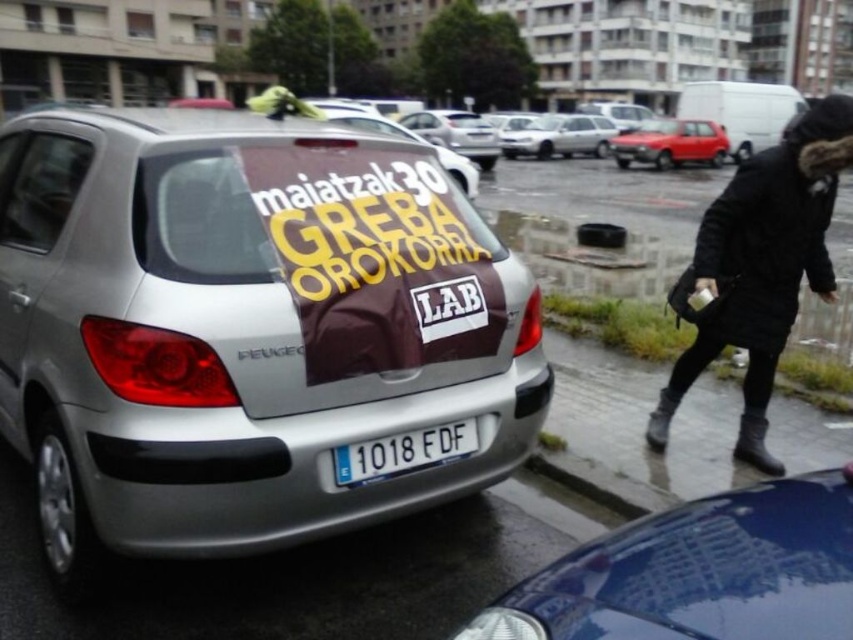
Question: Estimate the real-world distances between objects in this image. Which object is farther from the silver metallic hatchback at center?

Choices:
 (A) silver metallic car at center
 (B) shiny blue car at lower right
 (C) white plastic license plate at center
 (D) silver metallic sedan at center

Answer: (B)

Question: Considering the real-world distances, which object is closest to the white plastic license plate at center?

Choices:
 (A) shiny red car at center
 (B) silver metallic car at center
 (C) shiny blue car at lower right
 (D) silver metallic sedan at center

Answer: (B)

Question: Can you confirm if shiny blue car at lower right is smaller than shiny red car at center?

Choices:
 (A) yes
 (B) no

Answer: (A)

Question: Is silver metallic sedan at center to the right of silver metallic hatchback at center from the viewer's perspective?

Choices:
 (A) yes
 (B) no

Answer: (A)

Question: Which of the following is the farthest from the observer?

Choices:
 (A) shiny blue car at lower right
 (B) shiny red car at center

Answer: (B)

Question: Can you confirm if black fuzzy coat at right is positioned to the left of silver metallic hatchback at center?

Choices:
 (A) no
 (B) yes

Answer: (A)